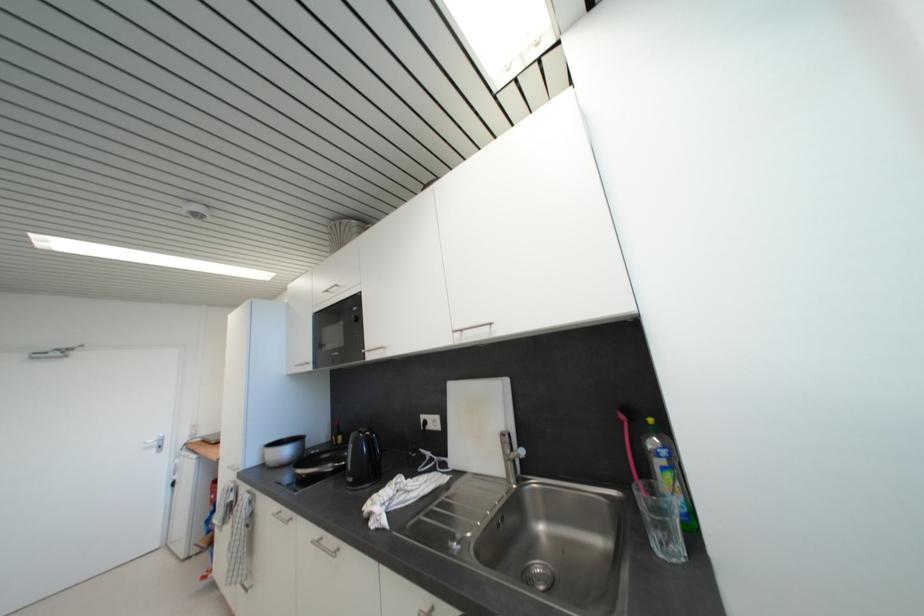
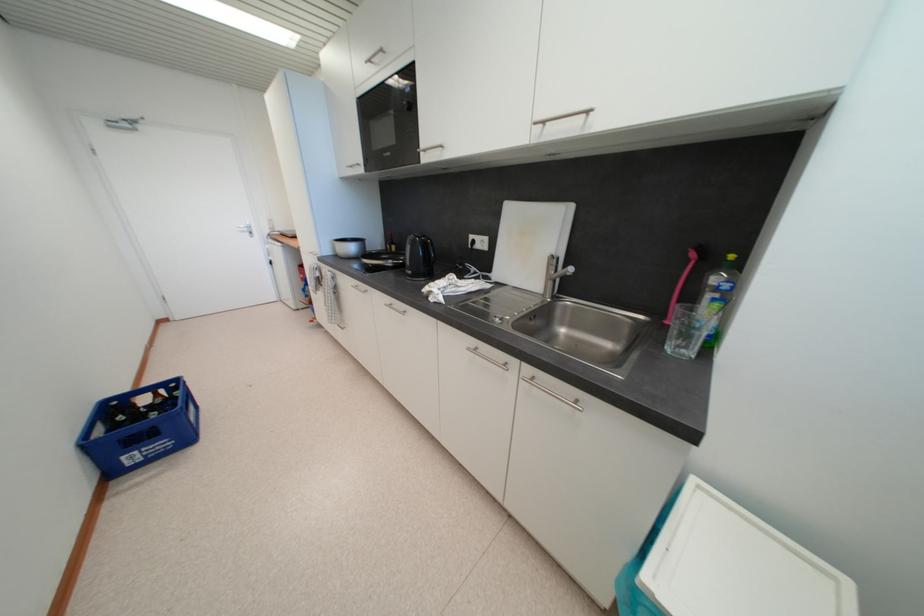
Locate, in the second image, the point that corresponds to pixel 292 455 in the first image.

(357, 251)